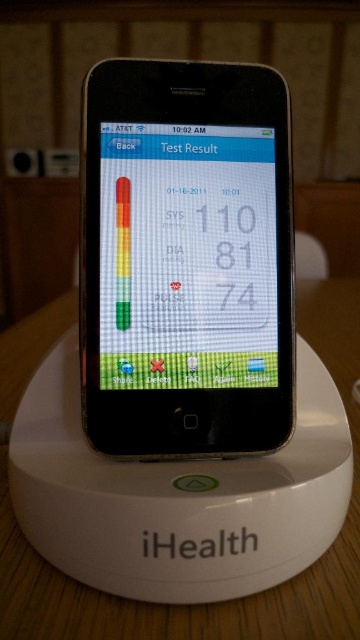
You are a nurse checking a patient monitor. You see the matte plastic screen at center and the white matte table at center. Which object is shorter in height?

The matte plastic screen at center has a lesser height compared to the white matte table at center, so the matte plastic screen at center is shorter in height.

You are using a smartphone app to track your health data. You notice two points on the screen. The first point is at coordinates point (191, 348), and the second point is at coordinates point (285, 598). Which point is closer to the bottom edge of the screen?

Point (285, 598) is closer to the bottom edge of the screen because its y coordinate is higher than point (191, 348).

Please describe the location of the point labeled as point [186,257] on the smartphone screen.

The point labeled as point [186,257] is located at the center of the matte plastic screen on the smartphone.